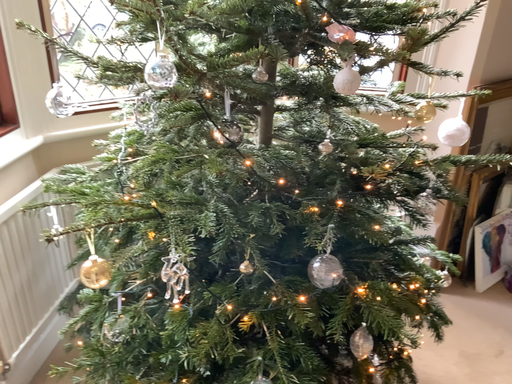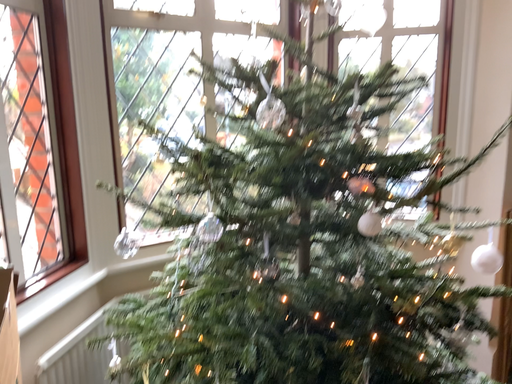
Question: Which way did the camera rotate in the video?

Choices:
 (A) rotated downward
 (B) rotated upward

Answer: (B)